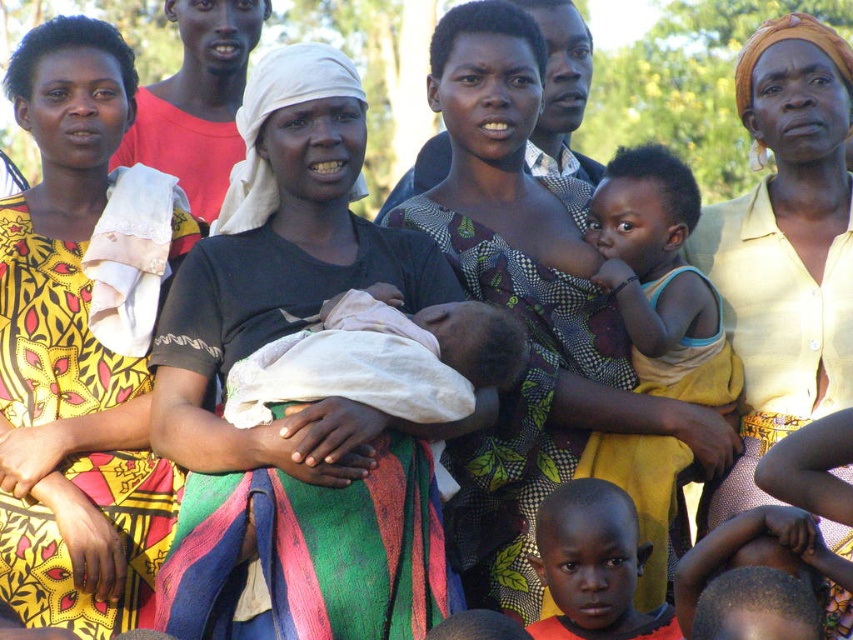
Who is positioned more to the left, light blue cotton shirt at center or white clothed baby at center?

white clothed baby at center is more to the left.

Is light blue cotton shirt at center below white clothed baby at center?

Incorrect, light blue cotton shirt at center is not positioned below white clothed baby at center.

The height and width of the screenshot is (640, 853). What do you see at coordinates (660, 278) in the screenshot?
I see `light blue cotton shirt at center` at bounding box center [660, 278].

Where is `light blue cotton shirt at center`? The height and width of the screenshot is (640, 853). light blue cotton shirt at center is located at coordinates (660, 278).

Is yellow printed fabric at left bigger than yellow cotton shirt at center?

Actually, yellow printed fabric at left might be smaller than yellow cotton shirt at center.

Is yellow printed fabric at left further to the viewer compared to yellow cotton shirt at center?

No, it is not.

Measure the distance between yellow printed fabric at left and camera.

yellow printed fabric at left is 49.35 meters from camera.

The width and height of the screenshot is (853, 640). In order to click on yellow printed fabric at left in this screenshot , I will do `click(71, 355)`.

Between yellow printed fabric at left and orange fabric baby at center, which one is positioned higher?

yellow printed fabric at left is higher up.

Does point (49, 163) come closer to viewer compared to point (558, 538)?

No.

Find the location of a particular element. This screenshot has width=853, height=640. yellow printed fabric at left is located at coordinates (71, 355).

Where is `yellow printed fabric at left`? yellow printed fabric at left is located at coordinates (71, 355).